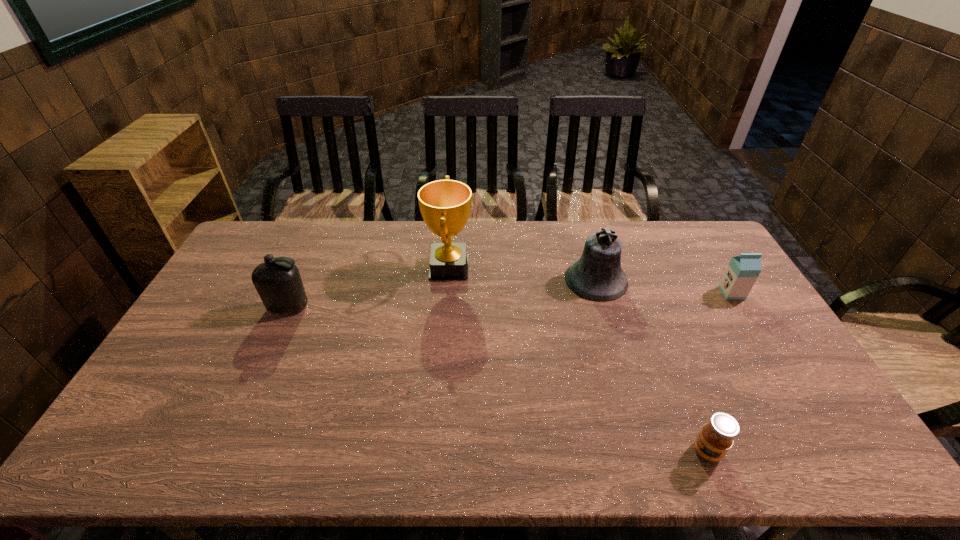
This screenshot has width=960, height=540. Identify the location of award. (445, 205).

At what (x,y) coordinates should I click in order to perform the action: click on the second object from left to right. Please return your answer as a coordinate pair (x, y). This screenshot has height=540, width=960. Looking at the image, I should click on (445, 205).

At what (x,y) coordinates should I click in order to perform the action: click on the leftmost object. Please return your answer as a coordinate pair (x, y). Looking at the image, I should click on (279, 285).

Image resolution: width=960 pixels, height=540 pixels. Find the location of `the third object from left to right`. the third object from left to right is located at coordinates (597, 276).

Locate an element on the screen. This screenshot has height=540, width=960. the fourth tallest object is located at coordinates (742, 271).

Image resolution: width=960 pixels, height=540 pixels. I want to click on the rightmost object, so click(742, 271).

Locate an element on the screen. the shortest object is located at coordinates (716, 437).

You are a GUI agent. You are given a task and a screenshot of the screen. Output one action in this format:
    pyautogui.click(x=<x>, y=<y>)
    Task: Click on the honey
    
    Given the screenshot: What is the action you would take?
    pyautogui.click(x=716, y=437)

The width and height of the screenshot is (960, 540). In order to click on vacant space located 0.150m on the front-facing side of the award in this screenshot , I will do click(516, 267).

The width and height of the screenshot is (960, 540). In order to click on free space located on the right of the bottle in this screenshot , I will do `click(360, 307)`.